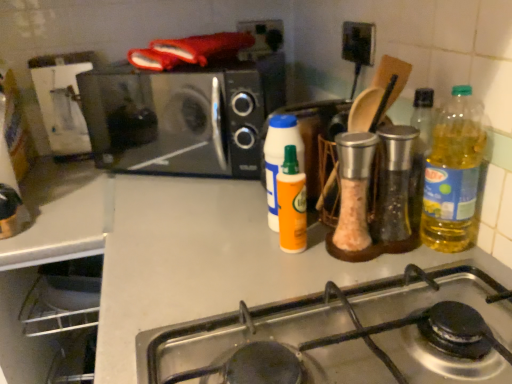
Describe the element at coordinates (353, 334) in the screenshot. I see `stainless steel gas stove at lower center` at that location.

The height and width of the screenshot is (384, 512). What do you see at coordinates (292, 204) in the screenshot?
I see `orange matte spray can at center, the 3th bottle when ordered from right to left` at bounding box center [292, 204].

How much space does orange matte bottle at center, which is the first bottle in left-to-right order, occupy horizontally?

The width of orange matte bottle at center, which is the first bottle in left-to-right order, is 2.78 inches.

The width and height of the screenshot is (512, 384). I want to click on yellow translucent bottle at right, the 1th bottle from the right, so click(453, 174).

Is translucent glass oil at center right, placed as the third bottle when sorted from left to right, outside of black matte microwave at upper left?

translucent glass oil at center right, placed as the third bottle when sorted from left to right, is positioned outside black matte microwave at upper left.

Is translucent glass oil at center right, placed as the third bottle when sorted from left to right, bigger than black matte microwave at upper left?

Incorrect, translucent glass oil at center right, placed as the third bottle when sorted from left to right, is not larger than black matte microwave at upper left.

From a real-world perspective, between translucent glass oil at center right, placed as the third bottle when sorted from left to right, and black matte microwave at upper left, who is vertically lower?

translucent glass oil at center right, placed as the third bottle when sorted from left to right.

Can you confirm if translucent glass oil at center right, placed as the third bottle when sorted from left to right, is shorter than black matte microwave at upper left?

Correct, translucent glass oil at center right, placed as the third bottle when sorted from left to right, is not as tall as black matte microwave at upper left.

Which object is positioned more to the left, black matte microwave at upper left or orange matte bottle at center, which appears as the 4th bottle when viewed from the right?

black matte microwave at upper left is more to the left.

Is black matte microwave at upper left not close to orange matte bottle at center, which is the first bottle in left-to-right order?

No, black matte microwave at upper left is not far away from orange matte bottle at center, which is the first bottle in left-to-right order.

Which is closer to the camera, (127, 130) or (302, 145)?

The point (302, 145) is closer.

Find the location of a particular element. The image size is (512, 384). microwave oven behind the orange matte bottle at center, which is the first bottle in left-to-right order is located at coordinates (182, 117).

Considering the relative sizes of black matte microwave at upper left and translucent glass oil at center right, placed as the third bottle when sorted from left to right, in the image provided, is black matte microwave at upper left taller than translucent glass oil at center right, placed as the third bottle when sorted from left to right,?

Correct, black matte microwave at upper left is much taller as translucent glass oil at center right, placed as the third bottle when sorted from left to right.

Which object is closer to the camera, black matte microwave at upper left or translucent glass oil at center right, which ranks as the 2th bottle in right-to-left order?

translucent glass oil at center right, which ranks as the 2th bottle in right-to-left order, is in front.

Is black matte microwave at upper left located outside translucent glass oil at center right, placed as the third bottle when sorted from left to right?

Yes, black matte microwave at upper left is not within translucent glass oil at center right, placed as the third bottle when sorted from left to right.

Does point (231, 170) come closer to viewer compared to point (397, 170)?

That is False.

From the image's perspective, is yellow translucent bottle at right, placed as the fourth bottle when sorted from left to right, on orange matte bottle at center, which is the first bottle in left-to-right order?

No, from the image's perspective, yellow translucent bottle at right, placed as the fourth bottle when sorted from left to right, is not above orange matte bottle at center, which is the first bottle in left-to-right order.

Does yellow translucent bottle at right, placed as the fourth bottle when sorted from left to right, touch orange matte bottle at center, which appears as the 4th bottle when viewed from the right?

No.

Considering the relative positions of yellow translucent bottle at right, placed as the fourth bottle when sorted from left to right, and orange matte bottle at center, which appears as the 4th bottle when viewed from the right, in the image provided, is yellow translucent bottle at right, placed as the fourth bottle when sorted from left to right, in front of orange matte bottle at center, which appears as the 4th bottle when viewed from the right,?

Yes, it is in front of orange matte bottle at center, which appears as the 4th bottle when viewed from the right.

Which is in front, point (457, 179) or point (290, 128)?

Point (457, 179)

Which object is positioned more to the right, black matte microwave at upper left or stainless steel gas stove at lower center?

stainless steel gas stove at lower center is more to the right.

Can you confirm if black matte microwave at upper left is wider than stainless steel gas stove at lower center?

No, black matte microwave at upper left is not wider than stainless steel gas stove at lower center.

Which object is closer to the camera taking this photo, black matte microwave at upper left or stainless steel gas stove at lower center?

Positioned in front is stainless steel gas stove at lower center.

From the image's perspective, is black matte microwave at upper left located above stainless steel gas stove at lower center?

Correct, black matte microwave at upper left appears higher than stainless steel gas stove at lower center in the image.

From the image's perspective, is translucent glass oil at center right, which ranks as the 2th bottle in right-to-left order, below yellow translucent bottle at right, placed as the fourth bottle when sorted from left to right?

Correct, translucent glass oil at center right, which ranks as the 2th bottle in right-to-left order, appears lower than yellow translucent bottle at right, placed as the fourth bottle when sorted from left to right, in the image.

Does translucent glass oil at center right, placed as the third bottle when sorted from left to right, turn towards yellow translucent bottle at right, the 1th bottle from the right?

No, translucent glass oil at center right, placed as the third bottle when sorted from left to right, is not turned towards yellow translucent bottle at right, the 1th bottle from the right.

From a real-world perspective, is translucent glass oil at center right, which ranks as the 2th bottle in right-to-left order, physically below yellow translucent bottle at right, placed as the fourth bottle when sorted from left to right?

Yes.

Could you measure the distance between translucent glass oil at center right, placed as the third bottle when sorted from left to right, and yellow translucent bottle at right, the 1th bottle from the right?

2.75 inches.

Which is closer, (x=430, y=309) or (x=406, y=158)?

The point (x=430, y=309) is in front.

What are the coordinates of `gas stove directly beneath the translucent glass oil at center right, which ranks as the 2th bottle in right-to-left order (from a real-world perspective)` in the screenshot? It's located at 353,334.

Could you tell me if stainless steel gas stove at lower center is facing translucent glass oil at center right, placed as the third bottle when sorted from left to right?

No, stainless steel gas stove at lower center does not turn towards translucent glass oil at center right, placed as the third bottle when sorted from left to right.

Is stainless steel gas stove at lower center at the right side of translucent glass oil at center right, which ranks as the 2th bottle in right-to-left order?

In fact, stainless steel gas stove at lower center is to the left of translucent glass oil at center right, which ranks as the 2th bottle in right-to-left order.

From a real-world perspective, count 3rd bottles downward from the black matte microwave at upper left and point to it. Please provide its 2D coordinates.

[(395, 190)]

This screenshot has height=384, width=512. Identify the location of microwave oven on the left of orange matte bottle at center, which appears as the 4th bottle when viewed from the right. (182, 117).

Estimate the real-world distances between objects in this image. Which object is closer to translucent glass oil at center right, which ranks as the 2th bottle in right-to-left order, stainless steel gas stove at lower center or black matte microwave at upper left?

stainless steel gas stove at lower center lies closer to translucent glass oil at center right, which ranks as the 2th bottle in right-to-left order, than the other object.

Looking at this image, based on their spatial positions, is translucent glass oil at center right, placed as the third bottle when sorted from left to right, or stainless steel gas stove at lower center further from orange matte spray can at center, the 3th bottle when ordered from right to left?

stainless steel gas stove at lower center is further to orange matte spray can at center, the 3th bottle when ordered from right to left.

In the scene shown: When comparing their distances from orange matte bottle at center, which appears as the 4th bottle when viewed from the right, does orange matte spray can at center, acting as the second bottle starting from the left, or stainless steel gas stove at lower center seem further?

stainless steel gas stove at lower center.

When comparing their distances from stainless steel gas stove at lower center, does orange matte spray can at center, acting as the second bottle starting from the left, or orange matte bottle at center, which is the first bottle in left-to-right order, seem further?

Based on the image, orange matte bottle at center, which is the first bottle in left-to-right order, appears to be further to stainless steel gas stove at lower center.

Looking at the image, which one is located closer to orange matte bottle at center, which appears as the 4th bottle when viewed from the right, translucent glass oil at center right, placed as the third bottle when sorted from left to right, or stainless steel gas stove at lower center?

Based on the image, translucent glass oil at center right, placed as the third bottle when sorted from left to right, appears to be nearer to orange matte bottle at center, which appears as the 4th bottle when viewed from the right.

Estimate the real-world distances between objects in this image. Which object is closer to stainless steel gas stove at lower center, black matte microwave at upper left or yellow translucent bottle at right, placed as the fourth bottle when sorted from left to right?

yellow translucent bottle at right, placed as the fourth bottle when sorted from left to right.

Based on their spatial positions, is orange matte spray can at center, the 3th bottle when ordered from right to left, or black matte microwave at upper left closer to yellow translucent bottle at right, placed as the fourth bottle when sorted from left to right?

Based on the image, orange matte spray can at center, the 3th bottle when ordered from right to left, appears to be nearer to yellow translucent bottle at right, placed as the fourth bottle when sorted from left to right.

Based on their spatial positions, is stainless steel gas stove at lower center or orange matte bottle at center, which appears as the 4th bottle when viewed from the right, closer to yellow translucent bottle at right, the 1th bottle from the right?

Based on the image, stainless steel gas stove at lower center appears to be nearer to yellow translucent bottle at right, the 1th bottle from the right.

Identify the location of bottle positioned between stainless steel gas stove at lower center and translucent glass oil at center right, placed as the third bottle when sorted from left to right, from near to far. The height and width of the screenshot is (384, 512). (453, 174).

Find the location of `bottle situated between orange matte spray can at center, acting as the second bottle starting from the left, and yellow translucent bottle at right, the 1th bottle from the right, from left to right`. bottle situated between orange matte spray can at center, acting as the second bottle starting from the left, and yellow translucent bottle at right, the 1th bottle from the right, from left to right is located at coordinates (395, 190).

Identify the location of bottle between orange matte bottle at center, which appears as the 4th bottle when viewed from the right, and translucent glass oil at center right, placed as the third bottle when sorted from left to right. (292, 204).